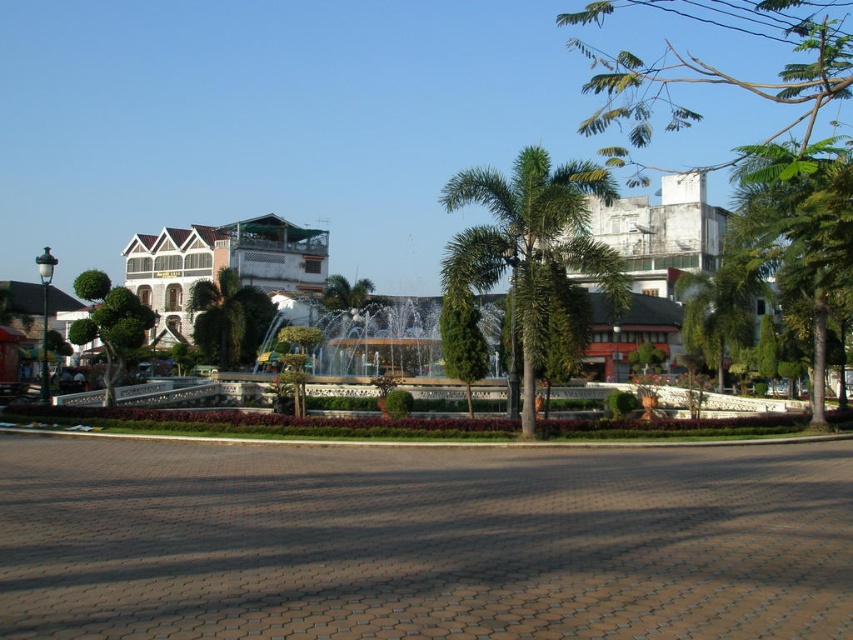
Which of these two, green concrete fountain at center or green leafy palm tree at center, stands shorter?

green concrete fountain at center

This screenshot has height=640, width=853. In order to click on green concrete fountain at center in this screenshot , I will do point(521,282).

Who is more distant from viewer, (689, 346) or (326, 264)?

The point (326, 264) is behind.

Between green concrete fountain at center and white textured building at center, which one has less height?

white textured building at center

Is point (540, 182) positioned before point (180, 250)?

Yes.

You are a GUI agent. You are given a task and a screenshot of the screen. Output one action in this format:
    pyautogui.click(x=<x>, y=<y>)
    Task: Click on the green concrete fountain at center
    The image size is (853, 640).
    Given the screenshot: What is the action you would take?
    pyautogui.click(x=521, y=282)

Is green leafy palm tree at center to the left of green leafy tree at center from the viewer's perspective?

In fact, green leafy palm tree at center is to the right of green leafy tree at center.

Does green leafy palm tree at center appear under green leafy tree at center?

Incorrect, green leafy palm tree at center is not positioned below green leafy tree at center.

Is point (529, 314) closer to camera compared to point (209, 342)?

That is True.

What are the coordinates of `green leafy palm tree at center` in the screenshot? It's located at (529, 244).